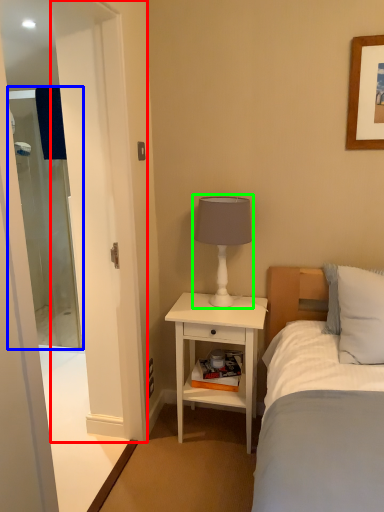
Question: Which is farther away from screen door (highlighted by a red box)? screen door (highlighted by a blue box) or table lamp (highlighted by a green box)?

Choices:
 (A) screen door
 (B) table lamp

Answer: (A)